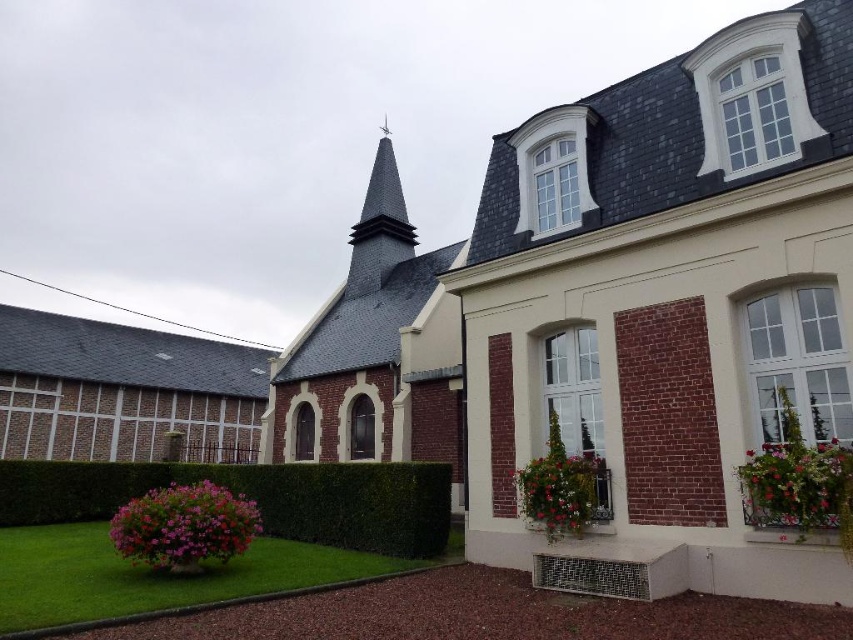
Can you confirm if brick steeple at center is thinner than green leafy hedge at lower center?

Yes, brick steeple at center is thinner than green leafy hedge at lower center.

Can you confirm if brick steeple at center is positioned below green leafy hedge at lower center?

No.

Is point (410, 310) positioned before point (132, 464)?

That is False.

The height and width of the screenshot is (640, 853). Identify the location of brick steeple at center. (375, 349).

Can you confirm if green grass at lower left is thinner than pink matte flower at lower left?

No.

Does green grass at lower left have a greater width compared to pink matte flower at lower left?

Correct, the width of green grass at lower left exceeds that of pink matte flower at lower left.

Find the location of `green grass at lower left`. green grass at lower left is located at coordinates (163, 577).

Between brick steeple at center and floral arrangement at lower right, which one has less height?

floral arrangement at lower right

Can you confirm if brick steeple at center is positioned above floral arrangement at lower right?

Yes, brick steeple at center is above floral arrangement at lower right.

The height and width of the screenshot is (640, 853). I want to click on brick steeple at center, so click(375, 349).